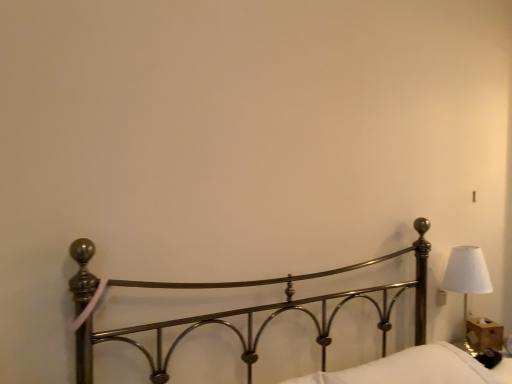
Measure the distance between white soft pillow at lower right and camera.

white soft pillow at lower right is 4.79 feet away from camera.

Locate an element on the screen. white fabric lampshade at right is located at coordinates (467, 274).

Can you tell me how much white fabric lampshade at right and white soft pillow at lower right differ in facing direction?

The angular difference between white fabric lampshade at right and white soft pillow at lower right is 4.48 degrees.

Is white fabric lampshade at right facing away from white soft pillow at lower right?

No, white fabric lampshade at right is not facing away from white soft pillow at lower right.

Between white fabric lampshade at right and white soft pillow at lower right, which one is positioned behind?

Positioned behind is white fabric lampshade at right.

Identify the location of lamp on the right of white soft pillow at lower right. (467, 274).

Between point (379, 367) and point (455, 286), which one is positioned behind?

The point (455, 286) is behind.

From the image's perspective, is white soft pillow at lower right under white fabric lampshade at right?

Yes, from the image's perspective, white soft pillow at lower right is below white fabric lampshade at right.

Is white soft pillow at lower right not close to white fabric lampshade at right?

No, white soft pillow at lower right is not far away from white fabric lampshade at right.

Measure the distance between polished metal bed at center and wooden tissue box at lower right.

polished metal bed at center is 28.75 inches away from wooden tissue box at lower right.

Which object is further away from the camera, polished metal bed at center or wooden tissue box at lower right?

wooden tissue box at lower right.

Which is farther, (273, 309) or (478, 343)?

The point (478, 343) is more distant.

From a real-world perspective, does polished metal bed at center stand above wooden tissue box at lower right?

Correct, in the physical world, polished metal bed at center is higher than wooden tissue box at lower right.

Which is closer, (455,280) or (498,329)?

The point (455,280) is closer.

Between white fabric lampshade at right and wooden tissue box at lower right, which one has smaller size?

wooden tissue box at lower right.

Between white fabric lampshade at right and wooden tissue box at lower right, which one has smaller width?

With smaller width is wooden tissue box at lower right.

Consider the image. Could you tell me if white fabric lampshade at right is turned towards wooden tissue box at lower right?

No.

Considering the positions of objects white soft pillow at lower right and wooden tissue box at lower right in the image provided, who is more to the right, white soft pillow at lower right or wooden tissue box at lower right?

Positioned to the right is wooden tissue box at lower right.

You are a GUI agent. You are given a task and a screenshot of the screen. Output one action in this format:
    pyautogui.click(x=<x>, y=<y>)
    Task: Click on the table beneath the white soft pillow at lower right (from a real-world perspective)
    The width and height of the screenshot is (512, 384).
    Given the screenshot: What is the action you would take?
    pyautogui.click(x=483, y=334)

How far apart are white soft pillow at lower right and wooden tissue box at lower right?

They are 23.94 inches apart.

Which of these two, polished metal bed at center or white soft pillow at lower right, is smaller?

white soft pillow at lower right.

Image resolution: width=512 pixels, height=384 pixels. Identify the location of pillow located behind the polished metal bed at center. (410, 369).

Can we say polished metal bed at center lies outside white soft pillow at lower right?

Yes.

Is polished metal bed at center wider or thinner than white soft pillow at lower right?

Considering their sizes, polished metal bed at center looks broader than white soft pillow at lower right.

In the image, is wooden tissue box at lower right positioned in front of or behind white soft pillow at lower right?

wooden tissue box at lower right is positioned farther from the viewer than white soft pillow at lower right.

From a real-world perspective, relative to white soft pillow at lower right, is wooden tissue box at lower right vertically above or below?

wooden tissue box at lower right is below white soft pillow at lower right.

Are wooden tissue box at lower right and white soft pillow at lower right beside each other?

No.

Find the location of a particular element. lamp that is behind the white soft pillow at lower right is located at coordinates [x=467, y=274].

Where is `lamp that is on the right side of white soft pillow at lower right`? The width and height of the screenshot is (512, 384). lamp that is on the right side of white soft pillow at lower right is located at coordinates (467, 274).

Looking at the image, which one is located closer to white fabric lampshade at right, polished metal bed at center or white soft pillow at lower right?

polished metal bed at center is positioned closer to the anchor white fabric lampshade at right.

Based on their spatial positions, is white fabric lampshade at right or wooden tissue box at lower right further from polished metal bed at center?

The object further to polished metal bed at center is wooden tissue box at lower right.

Based on their spatial positions, is white fabric lampshade at right or polished metal bed at center further from white soft pillow at lower right?

white fabric lampshade at right.

Considering their positions, is white soft pillow at lower right positioned further to polished metal bed at center than white fabric lampshade at right?

white fabric lampshade at right is further to polished metal bed at center.

Considering their positions, is white fabric lampshade at right positioned closer to white soft pillow at lower right than wooden tissue box at lower right?

The object closer to white soft pillow at lower right is white fabric lampshade at right.

When comparing their distances from white soft pillow at lower right, does wooden tissue box at lower right or white fabric lampshade at right seem closer?

white fabric lampshade at right lies closer to white soft pillow at lower right than the other object.

Estimate the real-world distances between objects in this image. Which object is further from white fabric lampshade at right, white soft pillow at lower right or wooden tissue box at lower right?

white soft pillow at lower right lies further to white fabric lampshade at right than the other object.

Looking at the image, which one is located closer to white soft pillow at lower right, polished metal bed at center or wooden tissue box at lower right?

The object closer to white soft pillow at lower right is polished metal bed at center.

In order to click on lamp located between polished metal bed at center and wooden tissue box at lower right in the depth direction in this screenshot , I will do `click(467, 274)`.

You are a GUI agent. You are given a task and a screenshot of the screen. Output one action in this format:
    pyautogui.click(x=<x>, y=<y>)
    Task: Click on the lamp between white soft pillow at lower right and wooden tissue box at lower right in the front-back direction
    This screenshot has width=512, height=384.
    Given the screenshot: What is the action you would take?
    pyautogui.click(x=467, y=274)

Find the location of `pillow located between polished metal bed at center and wooden tissue box at lower right in the depth direction`. pillow located between polished metal bed at center and wooden tissue box at lower right in the depth direction is located at coordinates (410, 369).

Find the location of a particular element. The width and height of the screenshot is (512, 384). pillow located between polished metal bed at center and white fabric lampshade at right in the depth direction is located at coordinates (410, 369).